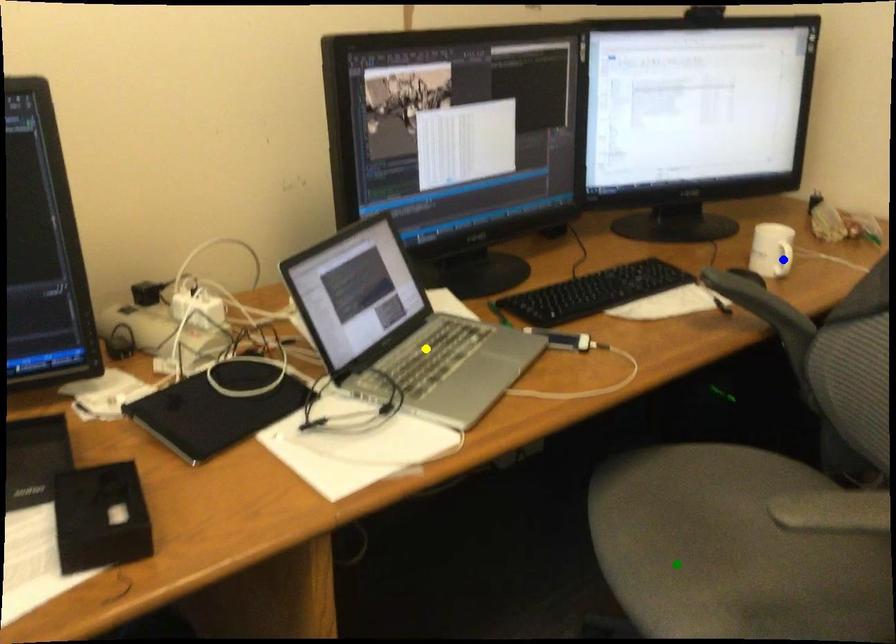
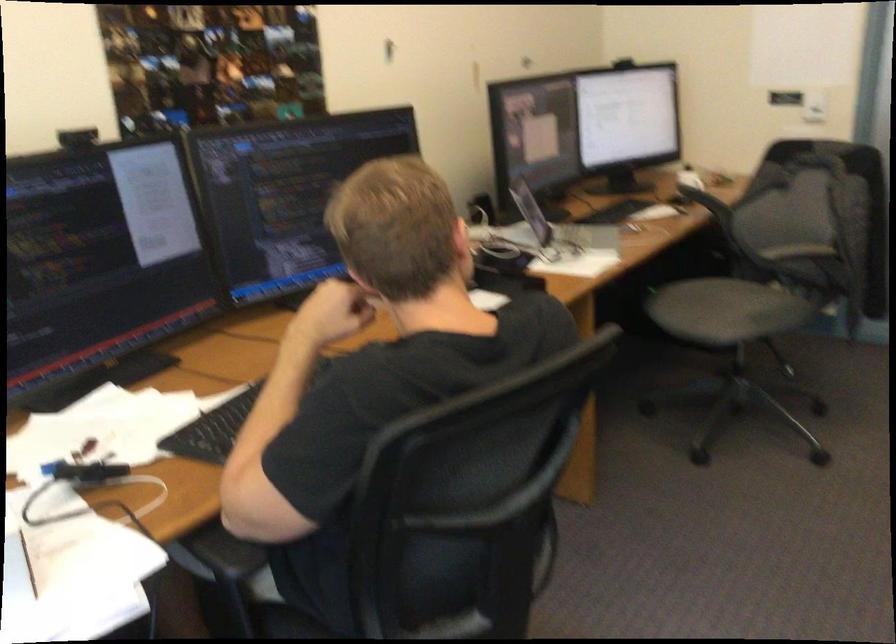
I am providing you with two images of the same scene from different viewpoints. Three points are marked in image1. Which point corresponds to a part or object that is occluded in image2?In image1, three points are marked. Which of them correspond to a part or object that is occluded in image2?Among the three points shown in image1, which one corresponds to a part or object that is no longer visible due to occlusion in image2?

blue point cannot be seen in image2.